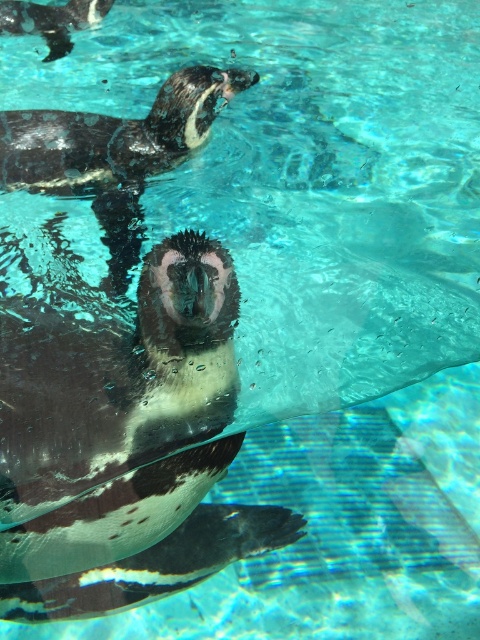
You are a zookeeper observing the penguins in their pool. You need to locate the black glossy penguin at center. Where exactly is it positioned in the image?

The black glossy penguin at center is positioned at point (124, 445) in the image.

What are the coordinates of the black glossy penguin at upper center in the image?

The black glossy penguin at upper center is located at coordinates point [116,152].

You are observing two penguins in a pool. The scene shows a black glossy penguin at upper center and a black glossy penguin at upper left. Which penguin is positioned more to the right side of the pool?

The black glossy penguin at upper center is positioned more to the right side of the pool compared to the black glossy penguin at upper left.